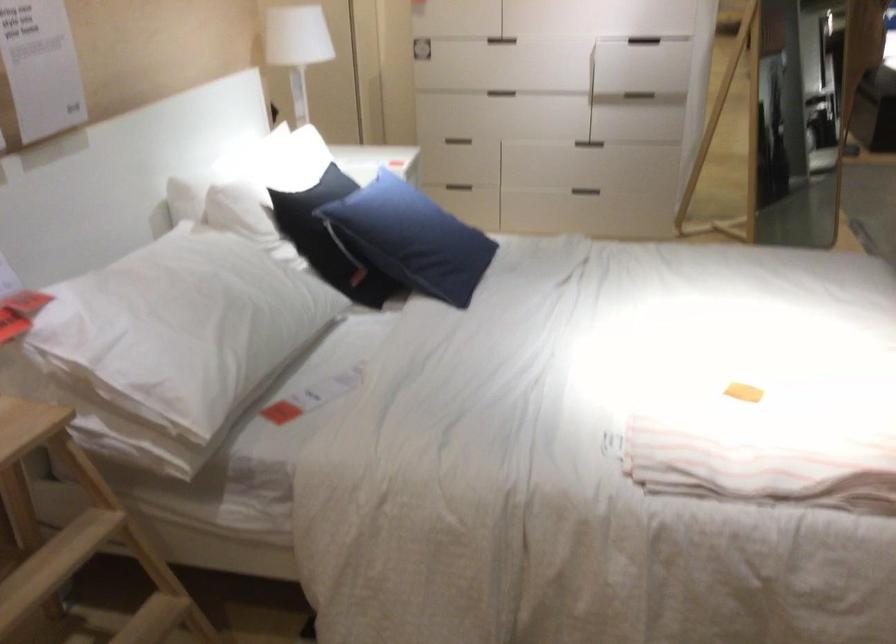
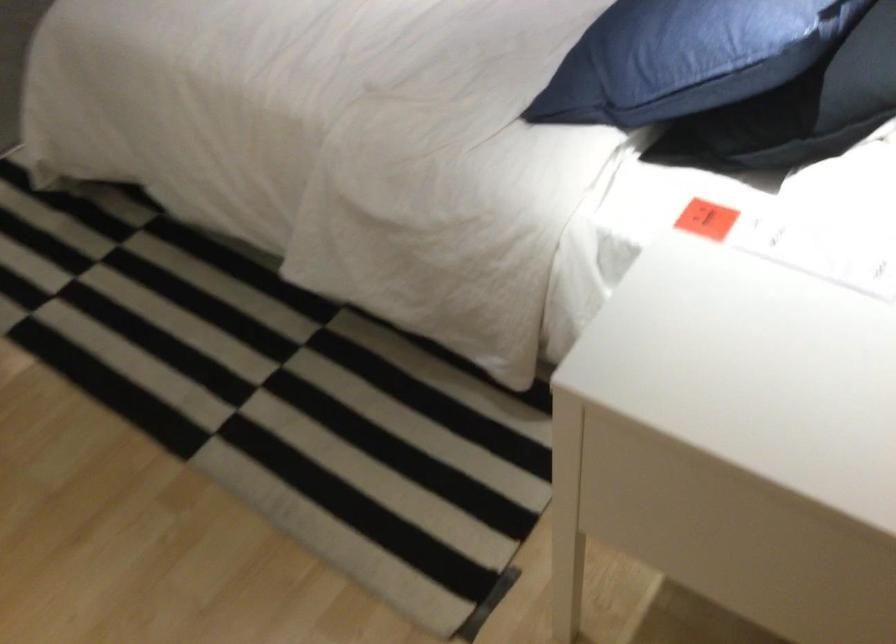
In the second image, find the point that corresponds to point (406, 166) in the first image.

(707, 219)